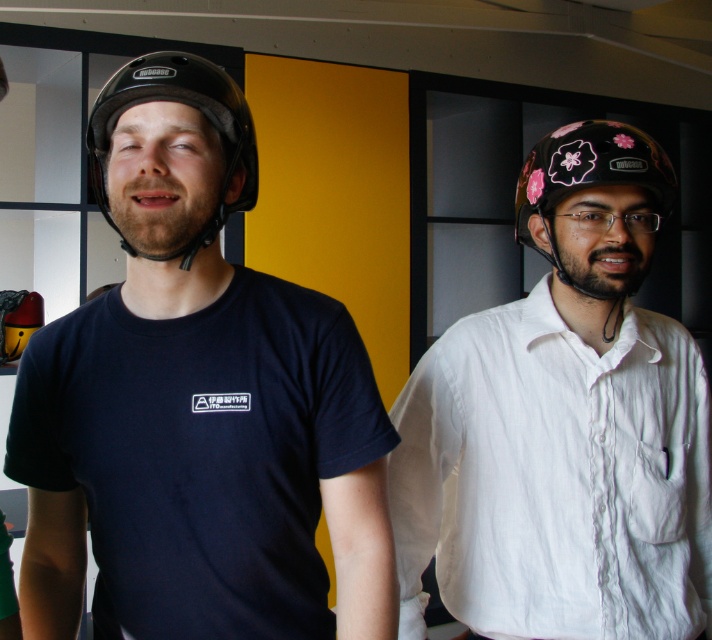
Looking at this image, you are standing in the room and want to place a small decoration between the two points, point (164, 266) and point (172, 58). Based on their positions, which point is closer to you where you should start placing the decoration?

Point (164, 266) is closer to you than point (172, 58), so you should start placing the decoration near point (164, 266) first.

From the picture: You are a photographer trying to capture the black matte helmet at left and the pink floral helmet at right. Given that the black matte helmet at left is located at point (187, 104), where should you position your camera to ensure both helmets are in frame?

The black matte helmet at left is located at point (187, 104). To capture both the black matte helmet at left and the pink floral helmet at right in frame, position your camera centrally between their coordinates so both are visible.